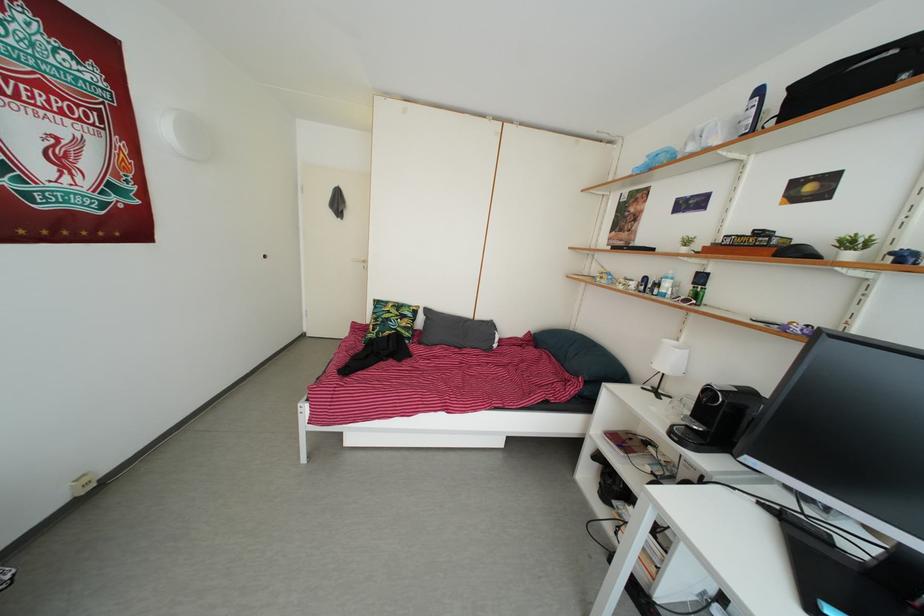
At what (x,y) coordinates should I click in order to perform the action: click on glass cup. Please return your answer as a coordinate pair (x, y). This screenshot has height=616, width=924. Looking at the image, I should click on (694, 292).